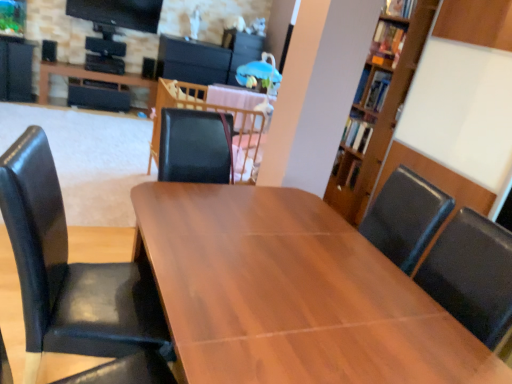
Question: From the image's perspective, is wooden table at center, marked as the second table in a front-to-back arrangement, located beneath black leather chair at left?

Choices:
 (A) yes
 (B) no

Answer: (B)

Question: Can you confirm if wooden table at center, marked as the second table in a front-to-back arrangement, is thinner than black leather chair at left?

Choices:
 (A) no
 (B) yes

Answer: (B)

Question: Is wooden table at center, the second table in the left-to-right sequence, directly adjacent to black leather chair at left?

Choices:
 (A) no
 (B) yes

Answer: (A)

Question: Is wooden table at center, marked as the second table in a front-to-back arrangement, aimed at black leather chair at left?

Choices:
 (A) no
 (B) yes

Answer: (A)

Question: Is wooden table at center, the second table in the bottom-to-top sequence, to the right of black leather chair at left from the viewer's perspective?

Choices:
 (A) no
 (B) yes

Answer: (B)

Question: Do you think wooden table at center, marked as the second table in a front-to-back arrangement, is within black leather chair at left, or outside of it?

Choices:
 (A) outside
 (B) inside

Answer: (A)

Question: Looking at the image, does wooden table at center, the second table positioned from the back, seem bigger or smaller compared to black leather chair at left?

Choices:
 (A) big
 (B) small

Answer: (B)

Question: From their relative heights in the image, would you say wooden table at center, marked as the second table in a front-to-back arrangement, is taller or shorter than black leather chair at left?

Choices:
 (A) short
 (B) tall

Answer: (A)

Question: From the image's perspective, relative to black leather chair at left, is wooden table at center, the 2th table in the top-to-bottom sequence, above or below?

Choices:
 (A) above
 (B) below

Answer: (A)

Question: Looking at their shapes, would you say black leather chair at left is wider or thinner than wooden table at center, acting as the 1th table starting from the bottom?

Choices:
 (A) thin
 (B) wide

Answer: (A)

Question: Considering the positions of black leather chair at left and wooden table at center, the third table viewed from the left, in the image, is black leather chair at left bigger or smaller than wooden table at center, the third table viewed from the left,?

Choices:
 (A) big
 (B) small

Answer: (B)

Question: Is point (89, 342) positioned closer to the camera than point (178, 347)?

Choices:
 (A) farther
 (B) closer

Answer: (A)

Question: Is black leather chair at left in front of or behind wooden table at center, the third table positioned from the top, in the image?

Choices:
 (A) front
 (B) behind

Answer: (B)

Question: Would you say black leather chair at left is to the left or to the right of wooden table at center, the second table positioned from the back, in the picture?

Choices:
 (A) right
 (B) left

Answer: (B)

Question: From a real-world perspective, is black leather chair at left above or below wooden table at center, which is counted as the 2th table, starting from the right?

Choices:
 (A) below
 (B) above

Answer: (A)